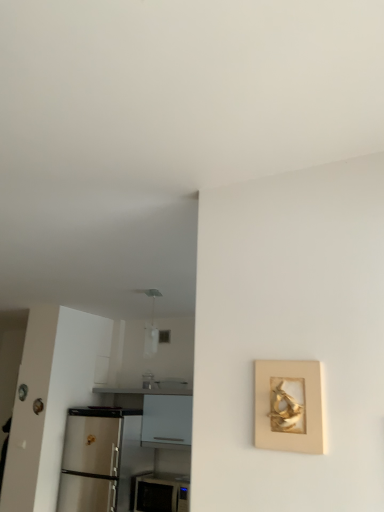
Question: Considering the relative positions of white glossy microwave at lower center and gold textured frame at right in the image provided, is white glossy microwave at lower center behind gold textured frame at right?

Choices:
 (A) no
 (B) yes

Answer: (B)

Question: Considering the relative sizes of white glossy microwave at lower center and gold textured frame at right in the image provided, is white glossy microwave at lower center bigger than gold textured frame at right?

Choices:
 (A) yes
 (B) no

Answer: (A)

Question: Considering the relative sizes of white glossy microwave at lower center and gold textured frame at right in the image provided, is white glossy microwave at lower center smaller than gold textured frame at right?

Choices:
 (A) yes
 (B) no

Answer: (B)

Question: Is white glossy microwave at lower center wider than gold textured frame at right?

Choices:
 (A) yes
 (B) no

Answer: (A)

Question: Considering the relative positions of white glossy microwave at lower center and gold textured frame at right in the image provided, is white glossy microwave at lower center to the left of gold textured frame at right from the viewer's perspective?

Choices:
 (A) yes
 (B) no

Answer: (A)

Question: From the image's perspective, is white glossy microwave at lower center located above or below white glossy counter at lower left?

Choices:
 (A) below
 (B) above

Answer: (A)

Question: Is white glossy microwave at lower center bigger or smaller than white glossy counter at lower left?

Choices:
 (A) big
 (B) small

Answer: (B)

Question: Would you say white glossy microwave at lower center is inside or outside white glossy counter at lower left?

Choices:
 (A) inside
 (B) outside

Answer: (B)

Question: Would you say white glossy microwave at lower center is to the left or to the right of white glossy counter at lower left in the picture?

Choices:
 (A) left
 (B) right

Answer: (B)

Question: Is point (261, 415) closer or farther from the camera than point (175, 484)?

Choices:
 (A) closer
 (B) farther

Answer: (A)

Question: Is gold textured frame at right spatially inside white glossy microwave at lower center, or outside of it?

Choices:
 (A) outside
 (B) inside

Answer: (A)

Question: From the image's perspective, is gold textured frame at right positioned above or below white glossy microwave at lower center?

Choices:
 (A) above
 (B) below

Answer: (A)

Question: Considering the positions of gold textured frame at right and white glossy microwave at lower center in the image, is gold textured frame at right taller or shorter than white glossy microwave at lower center?

Choices:
 (A) tall
 (B) short

Answer: (B)

Question: From the image's perspective, is white glossy microwave at lower center positioned above or below gold textured frame at right?

Choices:
 (A) above
 (B) below

Answer: (B)

Question: Would you say white glossy microwave at lower center is to the left or to the right of gold textured frame at right in the picture?

Choices:
 (A) left
 (B) right

Answer: (A)